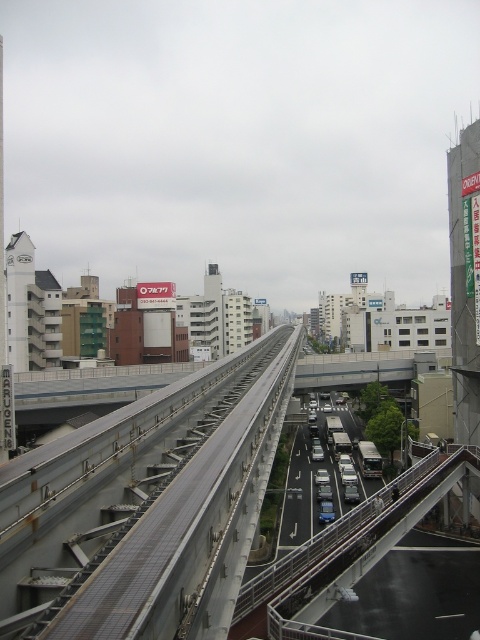
Does metallic gray highway at center have a greater width compared to white concrete overpass at center?

Incorrect, metallic gray highway at center's width does not surpass white concrete overpass at center's.

Which is in front, point (418, 496) or point (392, 371)?

Point (418, 496) is more forward.

Where is `metallic gray highway at center`? metallic gray highway at center is located at coordinates (342, 548).

Does metallic gray train track at center come in front of metallic gray highway at center?

Yes, metallic gray train track at center is in front of metallic gray highway at center.

Is metallic gray train track at center below metallic gray highway at center?

No, metallic gray train track at center is not below metallic gray highway at center.

Find the location of a particular element. This screenshot has width=480, height=640. metallic gray train track at center is located at coordinates (146, 506).

Can you confirm if metallic gray train track at center is wider than metallic blue sedan at center?

Yes.

From the picture: Which of these two, metallic gray train track at center or metallic blue sedan at center, stands shorter?

metallic blue sedan at center is shorter.

Who is more distant from viewer, (200, 481) or (324, 472)?

Point (324, 472)

Identify the location of metallic gray train track at center. (146, 506).